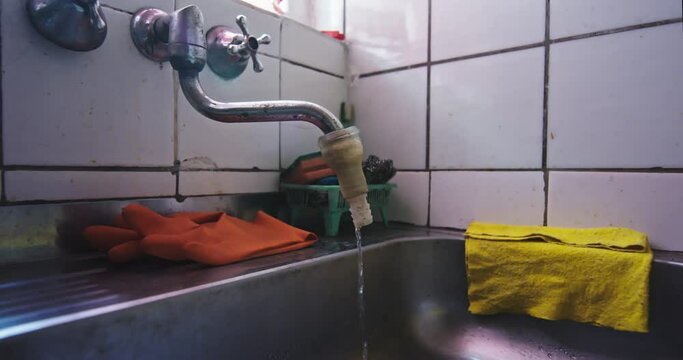
This screenshot has height=360, width=683. In order to click on tile in this screenshot , I will do `click(97, 123)`.